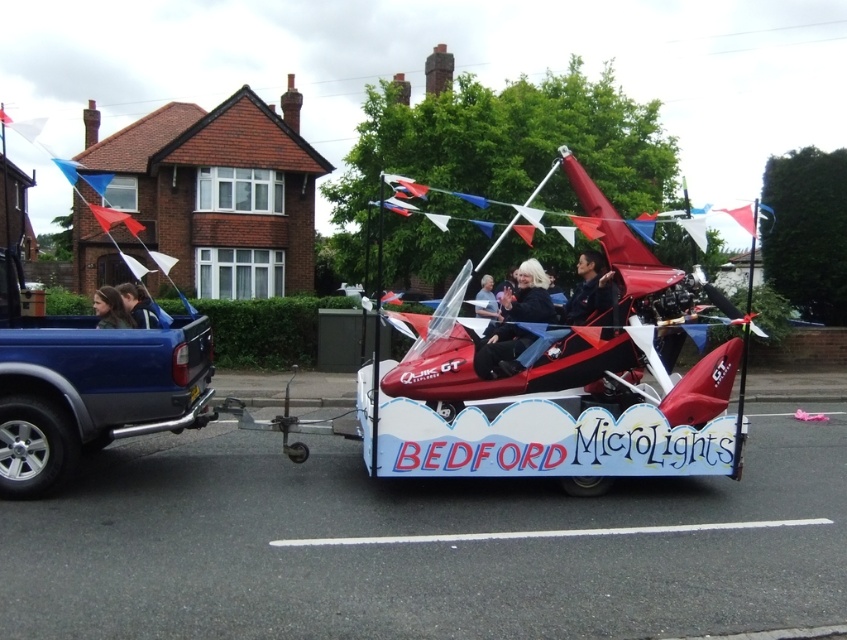
You are a photographer at the parade event. You need to capture a photo of the blonde hair at center and matte black jacket at center such that the blonde hair is on the left side of the photo. Is the current arrangement of these two items suitable for your photo?

The matte black jacket at center is to the right of blonde hair at center, so the current arrangement already has the blonde hair at center on the left side, making it suitable for the photo.

Based on the photo, you are a photographer at the parade and want to capture both the blonde hair at left and the light brown leather jacket at center in a single shot. Based on their positions, which object should you focus on first to ensure both are in frame?

You should focus on the light brown leather jacket at center first because the blonde hair at left is to the left of it, so by centering the jacket, the hair will naturally be included in the frame to its left.